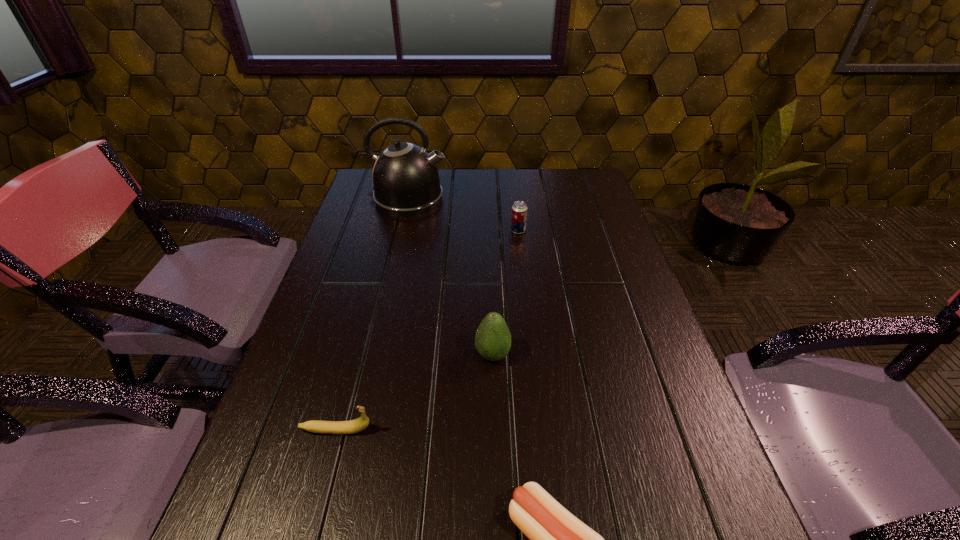
This screenshot has height=540, width=960. What are the coordinates of `free space between the tallest object and the second tallest object` in the screenshot? It's located at (450, 276).

Locate an element on the screen. This screenshot has width=960, height=540. free space between the tallest object and the fourth shortest object is located at coordinates (450, 276).

This screenshot has height=540, width=960. Find the location of `free point between the third farthest object and the second farthest object`. free point between the third farthest object and the second farthest object is located at coordinates (506, 293).

Locate an element on the screen. vacant space that is in between the tallest object and the avocado is located at coordinates (450, 276).

The width and height of the screenshot is (960, 540). What are the coordinates of `object that stands as the closest to the banana` in the screenshot? It's located at (493, 339).

Locate an element on the screen. This screenshot has width=960, height=540. object that is the second closest to the second farthest object is located at coordinates (493, 339).

The width and height of the screenshot is (960, 540). I want to click on vacant space that satisfies the following two spatial constraints: 1. on the back side of the second tallest object; 2. on the left side of the beer can, so click(490, 231).

Identify the location of free spot that satisfies the following two spatial constraints: 1. on the back side of the second tallest object; 2. on the left side of the second farthest object. (490, 231).

This screenshot has height=540, width=960. Find the location of `free space that satisfies the following two spatial constraints: 1. on the spout of the beer can; 2. on the left side of the farthest object`. free space that satisfies the following two spatial constraints: 1. on the spout of the beer can; 2. on the left side of the farthest object is located at coordinates (400, 231).

Identify the location of free space in the image that satisfies the following two spatial constraints: 1. on the front side of the avocado; 2. at the stem of the banana. (494, 430).